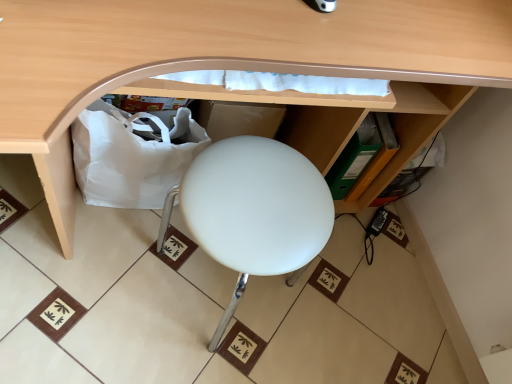
This screenshot has width=512, height=384. I want to click on vacant space that is to the left of white matte stool at center, so pos(95,276).